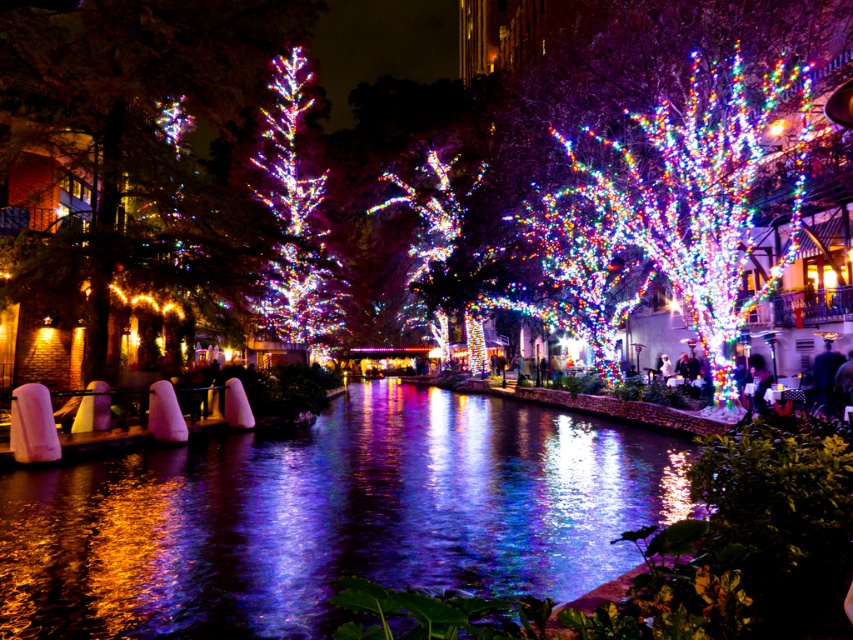
Between glossy concrete river at center and iridescent glass tree at center, which one appears on the right side from the viewer's perspective?

Positioned to the right is glossy concrete river at center.

Can you confirm if glossy concrete river at center is smaller than iridescent glass tree at center?

Correct, glossy concrete river at center occupies less space than iridescent glass tree at center.

I want to click on glossy concrete river at center, so click(331, 516).

Is colorful lights at center behind iridescent glass tree at center?

No, it is in front of iridescent glass tree at center.

Does colorful lights at center appear over iridescent glass tree at center?

Yes, colorful lights at center is above iridescent glass tree at center.

Locate an element on the screen. The height and width of the screenshot is (640, 853). colorful lights at center is located at coordinates (699, 192).

Does glossy concrete river at center appear on the right side of colorful lights at center?

No, glossy concrete river at center is not to the right of colorful lights at center.

Between glossy concrete river at center and colorful lights at center, which one has less height?

With less height is glossy concrete river at center.

You are a GUI agent. You are given a task and a screenshot of the screen. Output one action in this format:
    pyautogui.click(x=<x>, y=<y>)
    Task: Click on the glossy concrete river at center
    
    Given the screenshot: What is the action you would take?
    pyautogui.click(x=331, y=516)